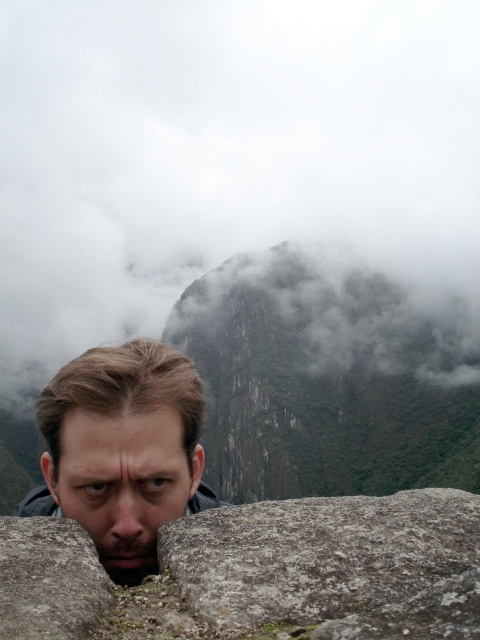
You are a photographer trying to capture a clear shot of the smooth skin face at center. However, there is cloudy mist at upper center obstructing the view. Based on the distance between them, can you estimate if the mist will affect the clarity of the face in your photo?

The cloudy mist at upper center and smooth skin face at center are 502.82 meters apart. Since the mist is in the background and the face is closer, the mist may not significantly affect the clarity of the face in the photo.

Based on the scene description, can you determine if the gray rough rock at center is wider than the smooth skin face at center?

The gray rough rock at center might be wider than smooth skin face at center according to the description.